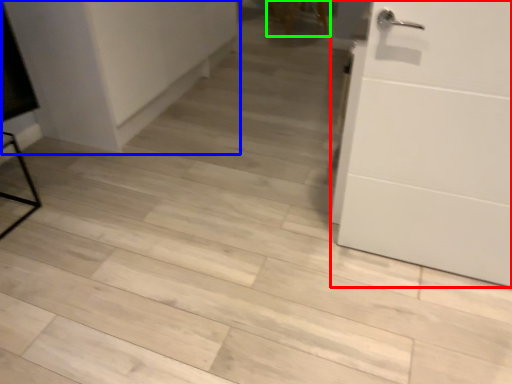
Question: Estimate the real-world distances between objects in this image. Which object is closer to door (highlighted by a red box), cabinetry (highlighted by a blue box) or chair (highlighted by a green box)?

Choices:
 (A) cabinetry
 (B) chair

Answer: (A)